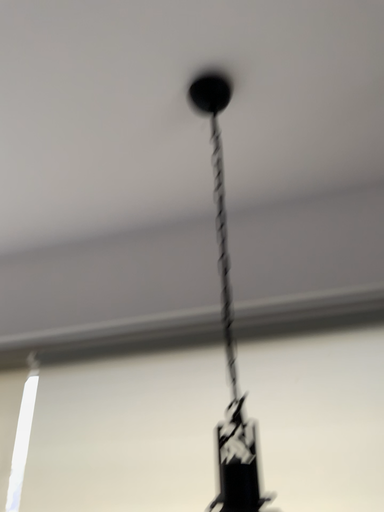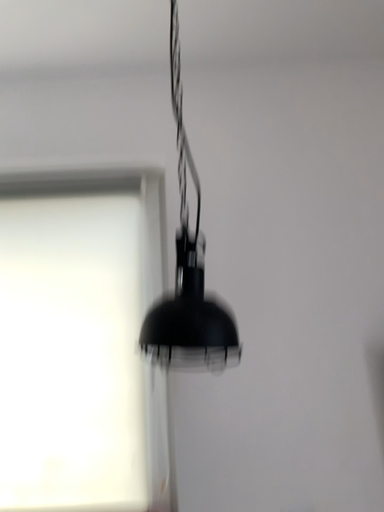
Question: How did the camera likely rotate when shooting the video?

Choices:
 (A) rotated downward
 (B) rotated upward

Answer: (A)